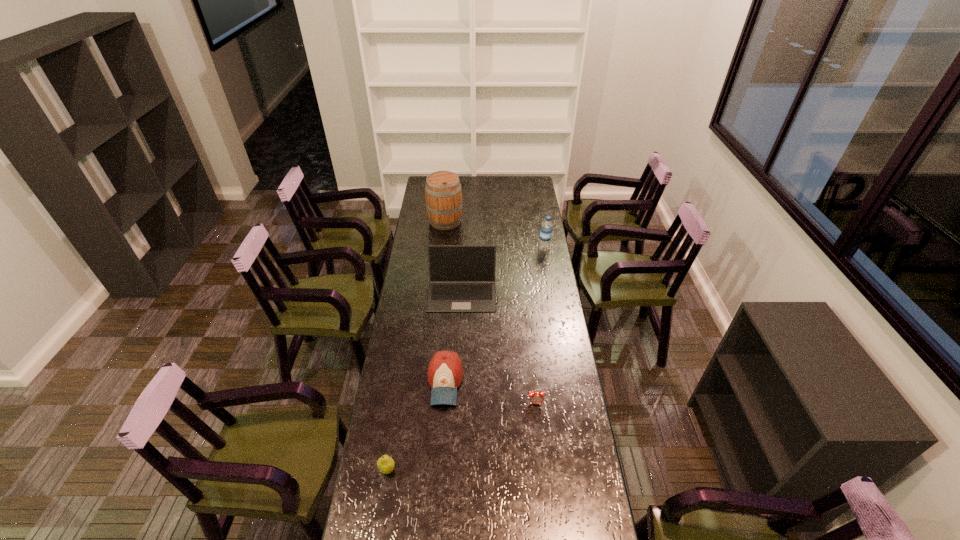
Where is `free region located 0.170m on the label of the water bottle`? This screenshot has width=960, height=540. free region located 0.170m on the label of the water bottle is located at coordinates (507, 248).

I want to click on vacant space located on the label of the water bottle, so click(521, 248).

Locate an element on the screen. free space located 0.050m on the screen of the laptop is located at coordinates (461, 320).

Identify the location of free space located 0.330m on the front-facing side of the baseball cap. The height and width of the screenshot is (540, 960). (437, 498).

At what (x,y) coordinates should I click in order to perform the action: click on vacant space located 0.090m on the face of the second object from right to left. Please return your answer as a coordinate pair (x, y). Looking at the image, I should click on (539, 428).

I want to click on free location located on the front of the pear, so click(x=381, y=505).

Image resolution: width=960 pixels, height=540 pixels. In order to click on cider that is at the left edge in this screenshot , I will do `click(443, 193)`.

Where is `laptop at the left edge`? The image size is (960, 540). laptop at the left edge is located at coordinates (461, 277).

You are a GUI agent. You are given a task and a screenshot of the screen. Output one action in this format:
    pyautogui.click(x=<x>, y=<y>)
    Task: Click on the pear that is at the left edge
    
    Given the screenshot: What is the action you would take?
    pyautogui.click(x=385, y=464)

Where is `water bottle that is at the right edge`? The image size is (960, 540). water bottle that is at the right edge is located at coordinates [546, 229].